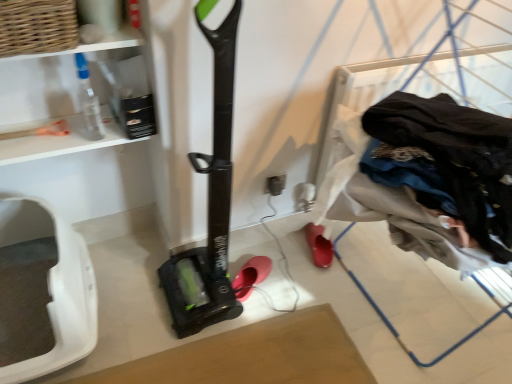
The height and width of the screenshot is (384, 512). What do you see at coordinates (435, 179) in the screenshot? I see `dark blue fabric at right` at bounding box center [435, 179].

Image resolution: width=512 pixels, height=384 pixels. What do you see at coordinates (251, 276) in the screenshot?
I see `pink matte shoe at center, the first footwear when ordered from left to right` at bounding box center [251, 276].

The image size is (512, 384). I want to click on pink matte shoe at center, placed as the 2th footwear when sorted from right to left, so click(x=251, y=276).

Locate an element on the screen. The height and width of the screenshot is (384, 512). dark blue fabric at right is located at coordinates (435, 179).

In the image, is woven brown basket at upper left positioned in front of or behind pink matte shoe at center, the first footwear when ordered from left to right?

Clearly, woven brown basket at upper left is in front of pink matte shoe at center, the first footwear when ordered from left to right.

From a real-world perspective, is woven brown basket at upper left beneath pink matte shoe at center, placed as the 2th footwear when sorted from right to left?

No, from a real-world perspective, woven brown basket at upper left is not below pink matte shoe at center, placed as the 2th footwear when sorted from right to left.

Would you say woven brown basket at upper left is outside pink matte shoe at center, the first footwear when ordered from left to right?

Yes.

Does woven brown basket at upper left have a lesser height compared to pink matte shoe at center, placed as the 2th footwear when sorted from right to left?

No, woven brown basket at upper left is not shorter than pink matte shoe at center, placed as the 2th footwear when sorted from right to left.

Is woven brown basket at upper left looking in the opposite direction of dark blue fabric at right?

That's not correct — woven brown basket at upper left is not looking away from dark blue fabric at right.

Between woven brown basket at upper left and dark blue fabric at right, which one appears on the left side from the viewer's perspective?

Positioned to the left is woven brown basket at upper left.

Which of these two, woven brown basket at upper left or dark blue fabric at right, is bigger?

dark blue fabric at right.

Would you say woven brown basket at upper left contains dark blue fabric at right?

No, dark blue fabric at right is located outside of woven brown basket at upper left.

Based on the photo, from the image's perspective, is matte gray electric outlet at center on top of translucent plastic bottle at upper left?

No.

Could you tell me if matte gray electric outlet at center is turned towards translucent plastic bottle at upper left?

No, matte gray electric outlet at center is not aimed at translucent plastic bottle at upper left.

Do you think matte gray electric outlet at center is within translucent plastic bottle at upper left, or outside of it?

The correct answer is: outside.

The height and width of the screenshot is (384, 512). Find the location of `shelf that appears above the matte gray electric outlet at center (from the image's perspective)`. shelf that appears above the matte gray electric outlet at center (from the image's perspective) is located at coordinates (73, 97).

I want to click on electric outlet located above the white plastic pet carrier at lower left (from the image's perspective), so click(x=276, y=184).

Does white plastic pet carrier at lower left have a larger size compared to matte gray electric outlet at center?

Indeed, white plastic pet carrier at lower left has a larger size compared to matte gray electric outlet at center.

Which is correct: pink matte shoe at center, placed as the 2th footwear when sorted from right to left, is inside translucent plastic bottle at upper left, or outside of it?

pink matte shoe at center, placed as the 2th footwear when sorted from right to left, cannot be found inside translucent plastic bottle at upper left.

Is pink matte shoe at center, the first footwear when ordered from left to right, positioned far away from translucent plastic bottle at upper left?

No.

Can you confirm if pink matte shoe at center, placed as the 2th footwear when sorted from right to left, is thinner than translucent plastic bottle at upper left?

Correct, the width of pink matte shoe at center, placed as the 2th footwear when sorted from right to left, is less than that of translucent plastic bottle at upper left.

Is pink matte shoe at center, the first footwear when ordered from left to right, closer to the viewer compared to translucent plastic bottle at upper left?

No, it is behind translucent plastic bottle at upper left.

Which is behind, point (104, 85) or point (96, 314)?

The point (96, 314) is farther.

Which of these two, translucent plastic bottle at upper left or white plastic pet carrier at lower left, stands shorter?

With less height is translucent plastic bottle at upper left.

Locate an element on the screen. shelf that appears behind the white plastic pet carrier at lower left is located at coordinates (73, 97).

Is dark blue fabric at right far from translucent plastic bottle at upper left?

No.

Is dark blue fabric at right oriented away from translucent plastic bottle at upper left?

That's not correct — dark blue fabric at right is not looking away from translucent plastic bottle at upper left.

Can we say dark blue fabric at right lies outside translucent plastic bottle at upper left?

Yes, dark blue fabric at right is outside of translucent plastic bottle at upper left.

Does dark blue fabric at right lie behind translucent plastic bottle at upper left?

Yes, dark blue fabric at right is further from the viewer.

Where is `basket on the left side of pink matte shoe at center, the first footwear when ordered from left to right`? The image size is (512, 384). basket on the left side of pink matte shoe at center, the first footwear when ordered from left to right is located at coordinates (37, 26).

Locate an element on the screen. Image resolution: width=512 pixels, height=384 pixels. clothing behind the woven brown basket at upper left is located at coordinates (435, 179).

Estimate the real-world distances between objects in this image. Which object is closer to rubberized red shoe at lower center, acting as the 1th footwear starting from the right, dark blue fabric at right or white plastic pet carrier at lower left?

Among the two, dark blue fabric at right is located nearer to rubberized red shoe at lower center, acting as the 1th footwear starting from the right.

Looking at the image, which one is located further to dark blue fabric at right, woven brown basket at upper left or white plastic pet carrier at lower left?

white plastic pet carrier at lower left is positioned further to the anchor dark blue fabric at right.

Based on their spatial positions, is pink matte shoe at center, the first footwear when ordered from left to right, or white plastic pet carrier at lower left closer to woven brown basket at upper left?

The object closer to woven brown basket at upper left is white plastic pet carrier at lower left.

Estimate the real-world distances between objects in this image. Which object is further from woven brown basket at upper left, pink matte shoe at center, the first footwear when ordered from left to right, or translucent plastic bottle at upper left?

pink matte shoe at center, the first footwear when ordered from left to right.

Estimate the real-world distances between objects in this image. Which object is closer to matte gray electric outlet at center, white plastic pet carrier at lower left or translucent plastic bottle at upper left?

translucent plastic bottle at upper left.

From the image, which object appears to be farther from woven brown basket at upper left, translucent plastic bottle at upper left or white plastic pet carrier at lower left?

Among the two, white plastic pet carrier at lower left is located further to woven brown basket at upper left.

Looking at this image, looking at the image, which one is located further to pink matte shoe at center, placed as the 2th footwear when sorted from right to left, dark blue fabric at right or rubberized red shoe at lower center, acting as the 1th footwear starting from the right?

dark blue fabric at right lies further to pink matte shoe at center, placed as the 2th footwear when sorted from right to left, than the other object.

Looking at the image, which one is located further to woven brown basket at upper left, pink matte shoe at center, placed as the 2th footwear when sorted from right to left, or matte gray electric outlet at center?

pink matte shoe at center, placed as the 2th footwear when sorted from right to left, lies further to woven brown basket at upper left than the other object.

The width and height of the screenshot is (512, 384). Identify the location of electric outlet between translucent plastic bottle at upper left and dark blue fabric at right. (276, 184).

Where is `footwear located between translucent plastic bottle at upper left and rubberized red shoe at lower center, marked as the second footwear in a left-to-right arrangement, in the left-right direction`? Image resolution: width=512 pixels, height=384 pixels. footwear located between translucent plastic bottle at upper left and rubberized red shoe at lower center, marked as the second footwear in a left-to-right arrangement, in the left-right direction is located at coordinates (251, 276).

This screenshot has height=384, width=512. I want to click on footwear between pink matte shoe at center, placed as the 2th footwear when sorted from right to left, and dark blue fabric at right, so [319, 245].

Image resolution: width=512 pixels, height=384 pixels. I want to click on shelf between woven brown basket at upper left and rubberized red shoe at lower center, acting as the 1th footwear starting from the right, so click(73, 97).